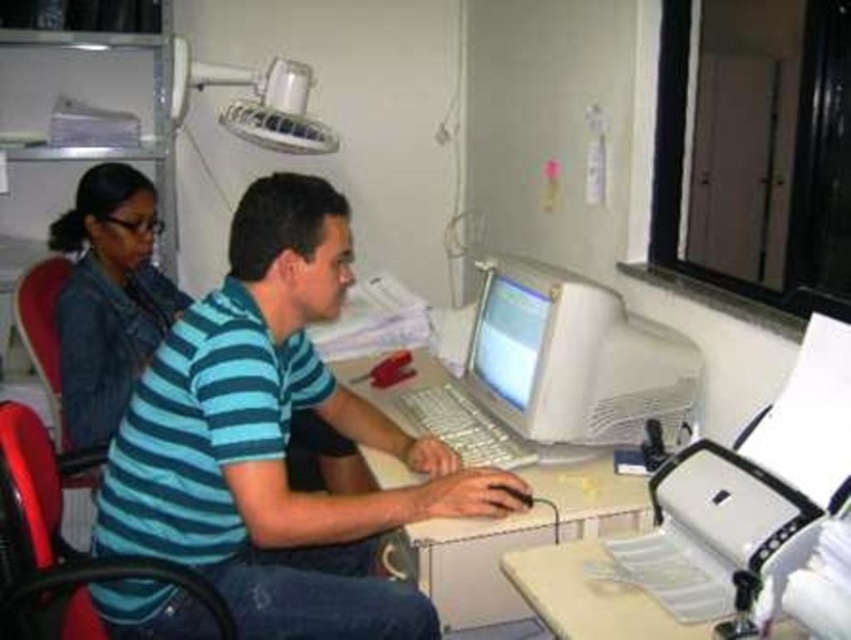
You need to move a box that is 1.2 meters wide from the red plastic swivel chair at left to the matte plastic monitor at center. Will the box fit between them without needing to be rotated?

The red plastic swivel chair at left is wider than the matte plastic monitor at center. Since the box is 1.2 meters wide, and the chair is wider, the space between them might be sufficient. However, without knowing the exact distance between the chair and monitor, it is uncertain if the box will fit without rotation.

You are a photographer taking a portrait of the blue striped shirt at center and the matte plastic monitor at center. Which object should you focus on first if you want to ensure both are in focus?

The blue striped shirt at center is positioned under matte plastic monitor at center, so focusing on the matte plastic monitor at center first would ensure both are in focus since it is farther away.

Based on the photo, you are standing at the front of the desk in the office scene. There are two points marked on the desk surface. From your perspective, which point is closer to you, point (575, 372) or point (500, 582)?

Point (500, 582) is closer to you because point (575, 372) is behind it.